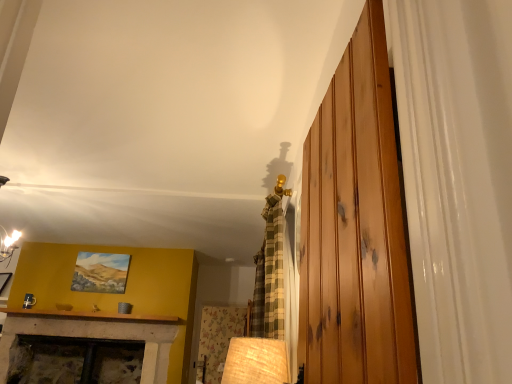
Describe the element at coordinates (100, 272) in the screenshot. This screenshot has height=384, width=512. I see `matte oil painting at upper left` at that location.

Where is `matte oil painting at upper left`? Image resolution: width=512 pixels, height=384 pixels. matte oil painting at upper left is located at coordinates (100, 272).

Measure the distance between point [382,128] and camera.

The depth of point [382,128] is 30.24 inches.

Describe the element at coordinates (355, 227) in the screenshot. I see `wooden at right` at that location.

Where is `wooden at right`? The width and height of the screenshot is (512, 384). wooden at right is located at coordinates (355, 227).

This screenshot has height=384, width=512. What are the coordinates of `matte oil painting at upper left` in the screenshot? It's located at (100, 272).

Is matte oil painting at upper left at the left side of wooden at right?

Yes, matte oil painting at upper left is to the left of wooden at right.

Is matte oil painting at upper left further to the viewer compared to wooden at right?

Yes.

Does point (90, 252) appear closer or farther from the camera than point (412, 325)?

Point (90, 252) is farther from the camera than point (412, 325).

From the image's perspective, would you say matte oil painting at upper left is shown under wooden at right?

Indeed, from the image's perspective, matte oil painting at upper left is shown beneath wooden at right.

From a real-world perspective, between matte oil painting at upper left and wooden at right, who is vertically lower?

wooden at right is physically lower.

Which of these two, matte oil painting at upper left or wooden at right, is thinner?

With smaller width is matte oil painting at upper left.

Considering the relative sizes of matte oil painting at upper left and wooden at right in the image provided, is matte oil painting at upper left taller than wooden at right?

No, matte oil painting at upper left is not taller than wooden at right.

Who is smaller, matte oil painting at upper left or wooden at right?

matte oil painting at upper left is smaller.

Is matte oil painting at upper left spatially inside wooden at right, or outside of it?

matte oil painting at upper left is spatially situated outside wooden at right.

Are matte oil painting at upper left and wooden at right far apart?

Indeed, matte oil painting at upper left is not near wooden at right.

Could you tell me if matte oil painting at upper left is turned towards wooden at right?

Yes, matte oil painting at upper left is turned towards wooden at right.

How different are the orientations of matte oil painting at upper left and wooden at right in degrees?

The angle between the facing direction of matte oil painting at upper left and the facing direction of wooden at right is 84 degrees.

There is a wooden at right. Identify the location of picture frame above it (from a real-world perspective). (100, 272).

Which is more to the right, wooden at right or matte oil painting at upper left?

From the viewer's perspective, wooden at right appears more on the right side.

Is wooden at right further to camera compared to matte oil painting at upper left?

No, it is not.

Considering the points (337, 210) and (113, 255), which point is behind, point (337, 210) or point (113, 255)?

Positioned behind is point (113, 255).

From the image's perspective, would you say wooden at right is shown under matte oil painting at upper left?

No, from the image's perspective, wooden at right is not beneath matte oil painting at upper left.

From a real-world perspective, between wooden at right and matte oil painting at upper left, who is vertically higher?

From a 3D spatial view, matte oil painting at upper left is above.

Is wooden at right wider or thinner than matte oil painting at upper left?

Clearly, wooden at right has more width compared to matte oil painting at upper left.

Is wooden at right shorter than matte oil painting at upper left?

In fact, wooden at right may be taller than matte oil painting at upper left.

Who is bigger, wooden at right or matte oil painting at upper left?

wooden at right is bigger.

Is wooden at right completely or partially outside of matte oil painting at upper left?

Yes, wooden at right is not within matte oil painting at upper left.

Is the surface of wooden at right in direct contact with matte oil painting at upper left?

There is a gap between wooden at right and matte oil painting at upper left.

Is wooden at right facing away from matte oil painting at upper left?

No, wooden at right is not facing the opposite direction of matte oil painting at upper left.

From the picture: What's the angular difference between wooden at right and matte oil painting at upper left's facing directions?

The angular difference between wooden at right and matte oil painting at upper left is 84 degrees.

Where is `picture frame located below the wooden at right (from the image's perspective)`? Image resolution: width=512 pixels, height=384 pixels. picture frame located below the wooden at right (from the image's perspective) is located at coordinates (100, 272).

Locate an element on the screen. The image size is (512, 384). barn door above the matte oil painting at upper left (from the image's perspective) is located at coordinates (355, 227).

At what (x,y) coordinates should I click in order to perform the action: click on barn door to the right of matte oil painting at upper left. Please return your answer as a coordinate pair (x, y). Looking at the image, I should click on (355, 227).